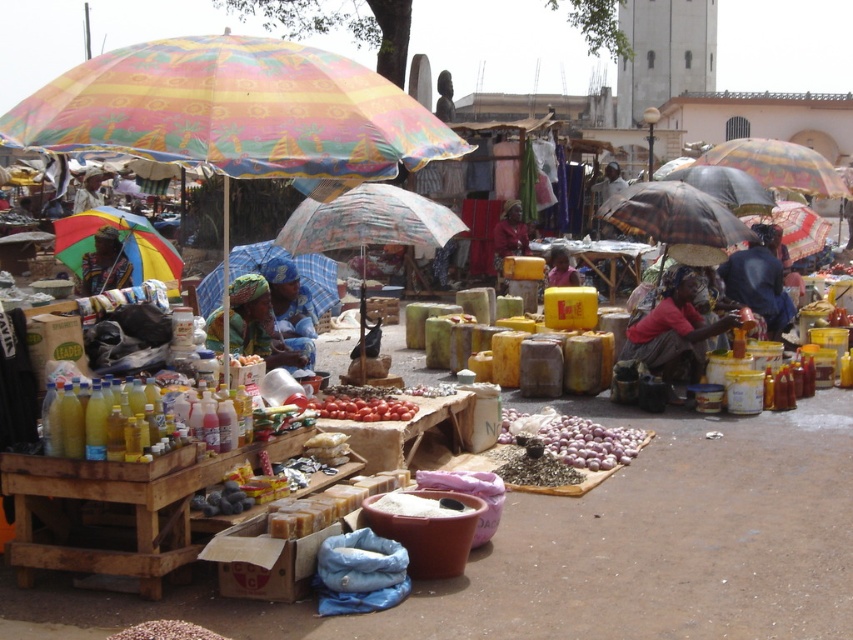
Question: Can you confirm if multicolored fabric umbrella at upper left is wider than matte black helmet at center?

Choices:
 (A) no
 (B) yes

Answer: (B)

Question: Based on their relative distances, which object is nearer to the plastic/glossy umbrella at center?

Choices:
 (A) dark blue fabric at center
 (B) white matte onions at center
 (C) rainbow fabric umbrella at left

Answer: (A)

Question: Does rainbow fabric umbrella at left have a greater width compared to matte black helmet at center?

Choices:
 (A) yes
 (B) no

Answer: (A)

Question: Which of the following is the farthest from the observer?

Choices:
 (A) dark blue fabric at center
 (B) multicolored fabric umbrella at center
 (C) matte pink shirt at center
 (D) matte black helmet at center

Answer: (C)

Question: Which of the following is the farthest from the observer?

Choices:
 (A) (291, 257)
 (B) (28, 140)

Answer: (A)

Question: Can you confirm if multicolored fabric umbrella at center is thinner than matte pink shirt at center?

Choices:
 (A) yes
 (B) no

Answer: (B)